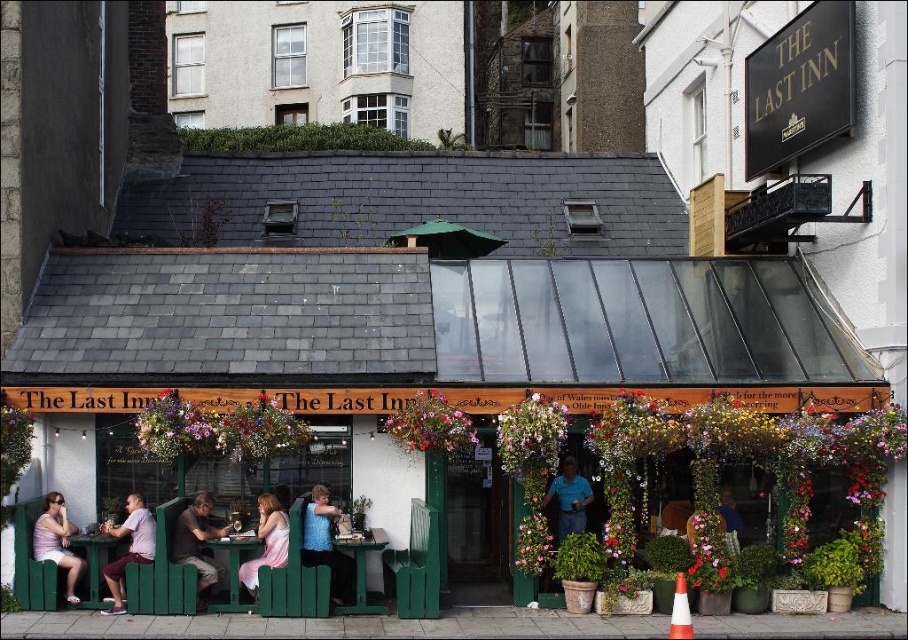
Question: Is pink fabric dress at center smaller than green plastic table at center?

Choices:
 (A) yes
 (B) no

Answer: (A)

Question: Considering the relative positions of blue sleeveless top at center and green plastic table at center in the image provided, where is blue sleeveless top at center located with respect to green plastic table at center?

Choices:
 (A) above
 (B) below

Answer: (A)

Question: Does dark brown leather jacket at center have a smaller size compared to blue cotton shirt at center?

Choices:
 (A) yes
 (B) no

Answer: (B)

Question: Which point is closer to the camera?

Choices:
 (A) pink fabric dress at center
 (B) light purple shirt at lower left

Answer: (A)

Question: Among these points, which one is nearest to the camera?

Choices:
 (A) (132, 515)
 (B) (80, 545)
 (C) (181, 541)

Answer: (B)

Question: Among these points, which one is nearest to the camera?

Choices:
 (A) (331, 554)
 (B) (151, 544)
 (C) (220, 579)
 (D) (70, 589)

Answer: (D)